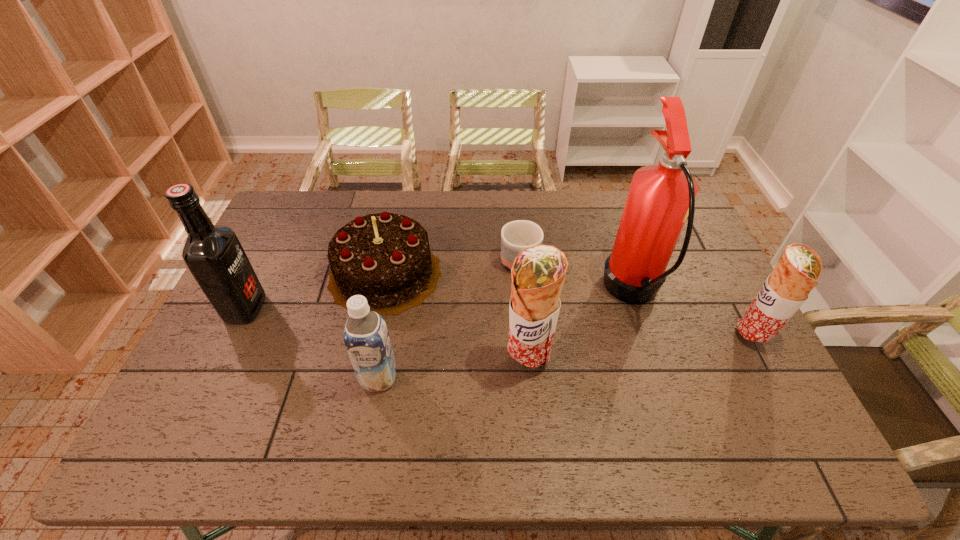
The image size is (960, 540). Find the location of `the taller burrito`. the taller burrito is located at coordinates (538, 273).

Find the location of a particular element. the rightmost object is located at coordinates (786, 289).

Where is `the right burrito`? This screenshot has height=540, width=960. the right burrito is located at coordinates [786, 289].

Where is `the sixth tallest object`? The width and height of the screenshot is (960, 540). the sixth tallest object is located at coordinates (385, 257).

I want to click on the shortest object, so click(516, 236).

Image resolution: width=960 pixels, height=540 pixels. Identify the location of fire extinguisher. (661, 197).

At what (x,y) coordinates should I click in order to perform the action: click on the second object from right to left. Please return your answer as a coordinate pair (x, y). The image size is (960, 540). Looking at the image, I should click on (661, 197).

You are a GUI agent. You are given a task and a screenshot of the screen. Output one action in this format:
    pyautogui.click(x=<x>, y=<y>)
    Task: Click on the soya milk
    This screenshot has width=960, height=540.
    Given the screenshot: What is the action you would take?
    pyautogui.click(x=366, y=337)

At what (x,y) coordinates should I click in order to perform the action: click on liquor. Please return your answer as a coordinate pair (x, y). The width and height of the screenshot is (960, 540). Looking at the image, I should click on (214, 255).

Locate an element on the screen. This screenshot has height=540, width=960. blank area located 0.080m on the front of the left burrito is located at coordinates (531, 410).